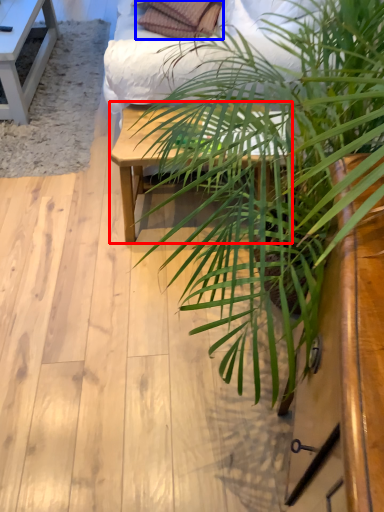
Question: Among these objects, which one is nearest to the camera, table (highlighted by a red box) or pillow (highlighted by a blue box)?

Choices:
 (A) table
 (B) pillow

Answer: (A)